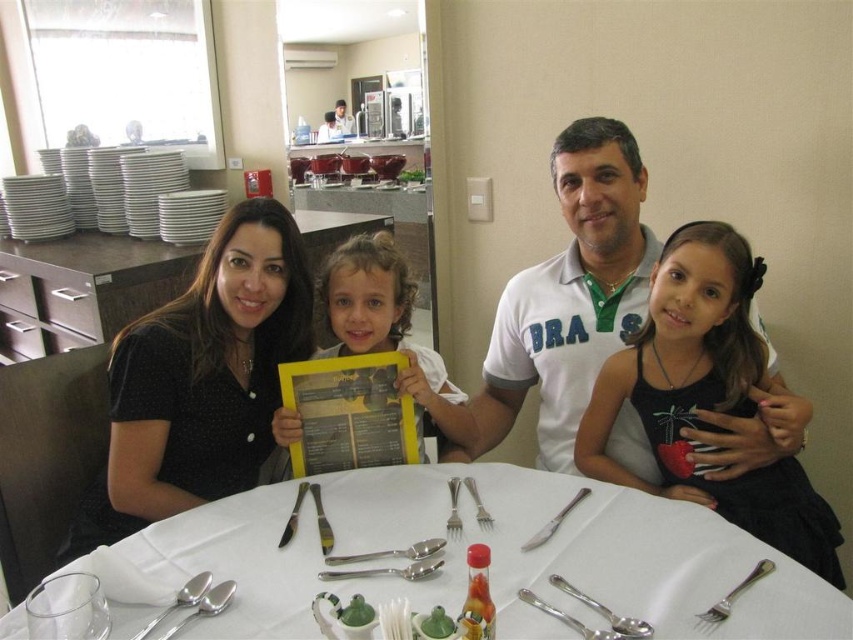
Question: Which is nearer to the silver metallic fork at table?

Choices:
 (A) white matte table at center
 (B) silvermetallicspoon at lower left

Answer: (A)

Question: Can you confirm if yellow paper menu at center is positioned above satin silver fork at table center?

Choices:
 (A) yes
 (B) no

Answer: (A)

Question: Which of the following is the closest to the observer?

Choices:
 (A) (527, 564)
 (B) (154, 624)

Answer: (B)

Question: Observing the image, what is the correct spatial positioning of polished silver spoon at center in reference to shiny silver knife at upper center?

Choices:
 (A) right
 (B) left

Answer: (A)

Question: Which point appears farthest from the camera in this image?

Choices:
 (A) (341, 269)
 (B) (457, 536)

Answer: (A)

Question: Can you confirm if white polo shirt at center is thinner than polished silver spoon at center?

Choices:
 (A) yes
 (B) no

Answer: (B)